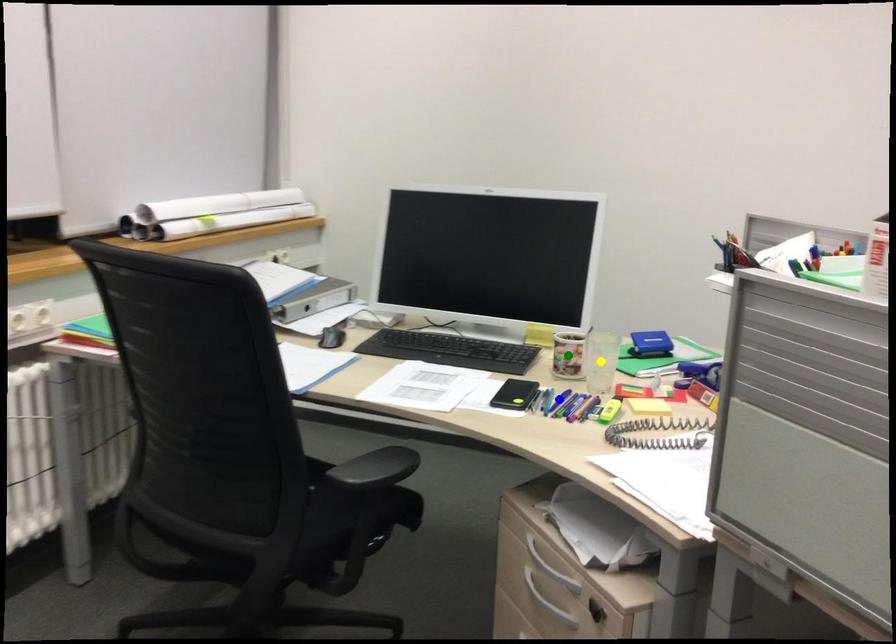
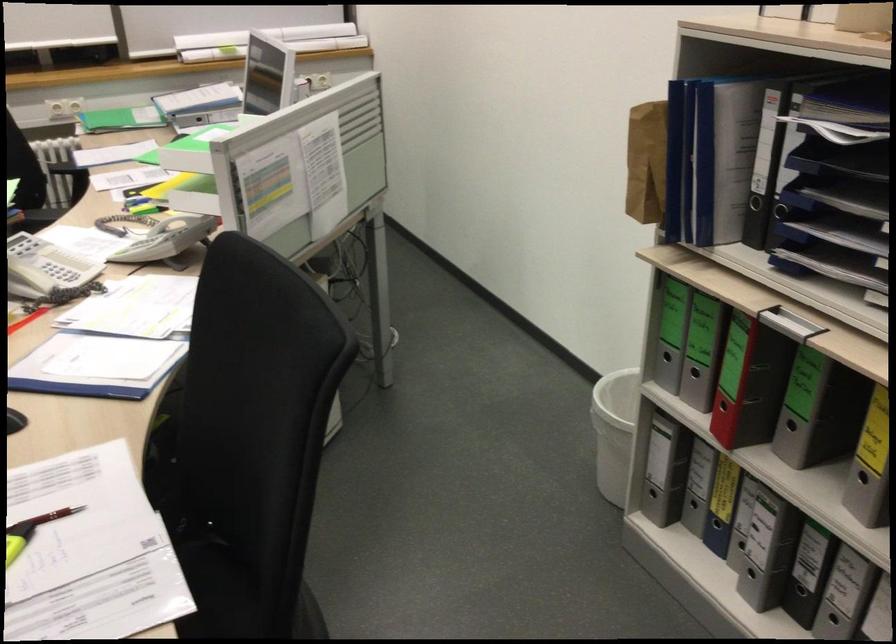
I am providing you with two images of the same scene from different viewpoints. Three points are marked in image1. Which point corresponds to a part or object that is occluded in image2?In image1, three points are marked. Which of them correspond to a part or object that is occluded in image2?Among the three points shown in image1, which one corresponds to a part or object that is no longer visible due to occlusion in image2?

yellow point, green point, blue point cannot be seen in image2.